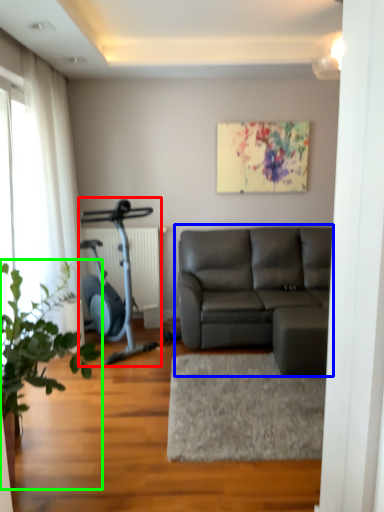
Question: Which object is the farthest from stationary bicycle (highlighted by a red box)? Choose among these: studio couch (highlighted by a blue box) or houseplant (highlighted by a green box).

Choices:
 (A) studio couch
 (B) houseplant

Answer: (B)